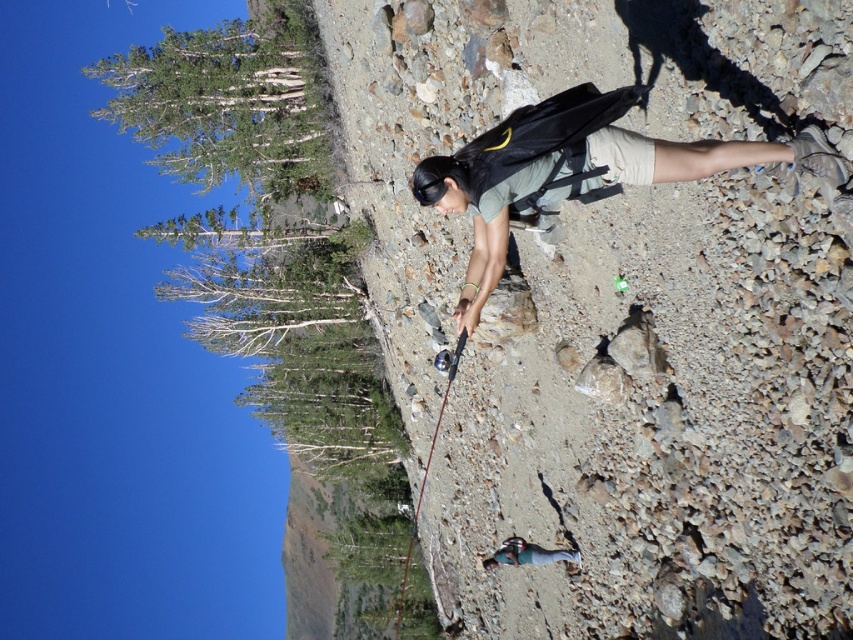
The width and height of the screenshot is (853, 640). Describe the element at coordinates (659, 419) in the screenshot. I see `brown rocky cliff at center` at that location.

Who is positioned more to the right, brown rocky cliff at center or matte gray backpack at center?

matte gray backpack at center is more to the right.

Between point (608, 340) and point (521, 540), which one is positioned behind?

Positioned behind is point (521, 540).

Image resolution: width=853 pixels, height=640 pixels. What are the coordinates of `brown rocky cliff at center` in the screenshot? It's located at (659, 419).